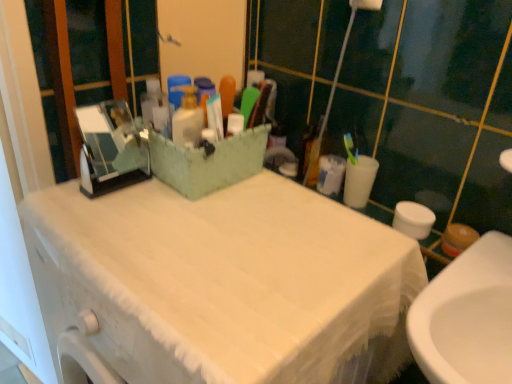
This screenshot has width=512, height=384. I want to click on blank space above white fabric-covered cabinet at center (from a real-world perspective), so coord(212,229).